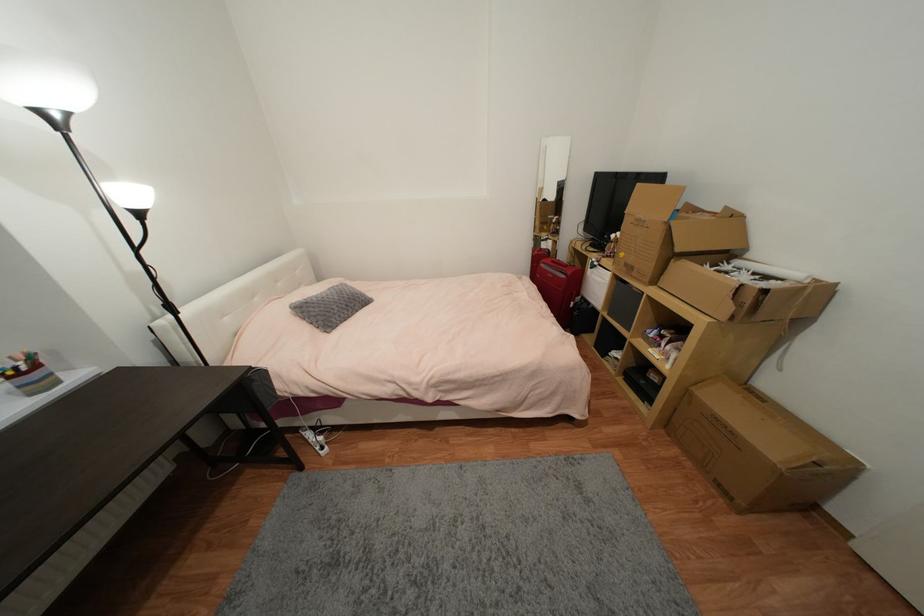
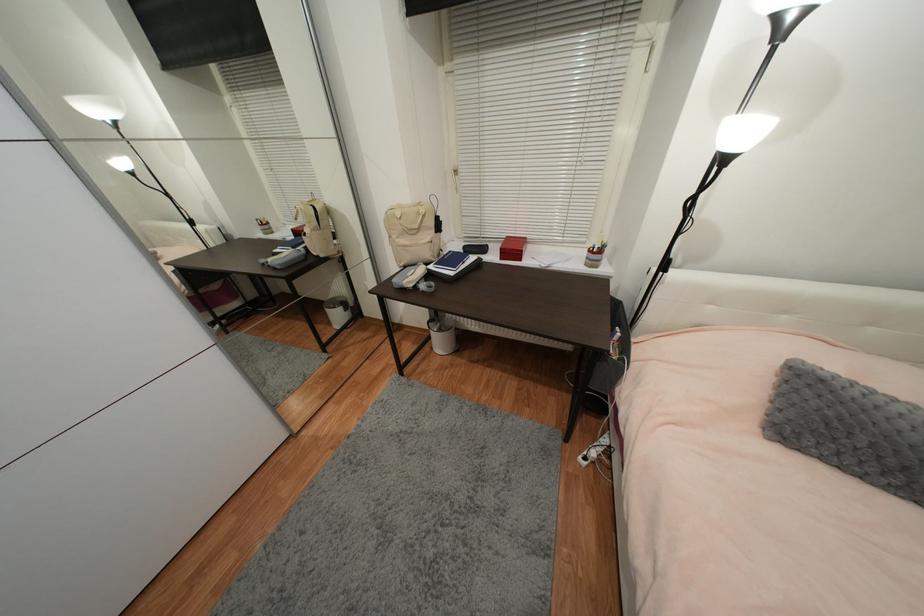
Based on the continuous images, in which direction is the camera rotating?

The camera rotated toward left-down.